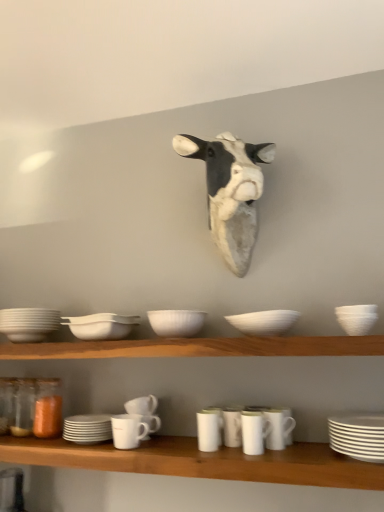
Locate an element on the screen. The image size is (384, 512). vacant area that lies between white matte mug at lower center, marked as the eighth tableware in a right-to-left arrangement, and white matte cup at center, which appears as the 6th tableware when viewed from the left is located at coordinates (169, 449).